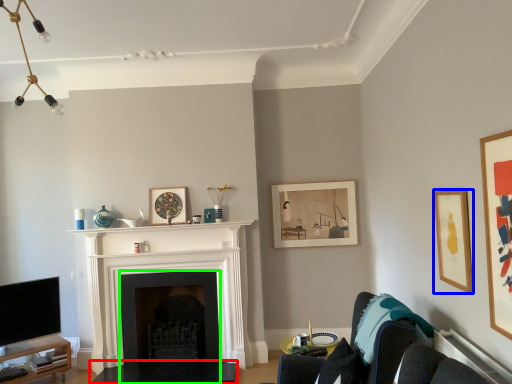
Question: Based on their relative distances, which object is farther from table (highlighted by a red box)? Choose from picture frame (highlighted by a blue box) and fireplace (highlighted by a green box).

Choices:
 (A) picture frame
 (B) fireplace

Answer: (A)